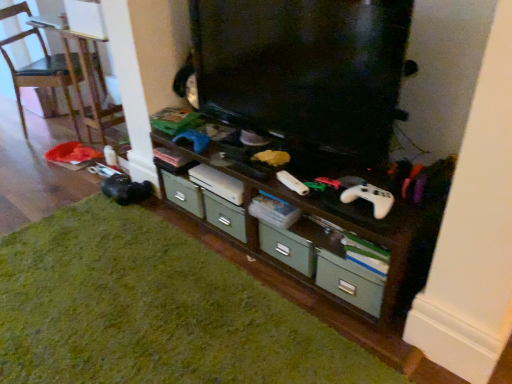
In order to face white matte game controller at center, should I rotate leftwards or rightwards?

To face it directly, rotate right by 15.064 degrees.

What is the approximate width of green matte hardwood at lower left?

green matte hardwood at lower left is 1.80 meters in width.

Describe the element at coordinates (305, 70) in the screenshot. Image resolution: width=512 pixels, height=384 pixels. I see `black glossy television at center` at that location.

What do you see at coordinates (329, 218) in the screenshot?
I see `wooden shelf at center` at bounding box center [329, 218].

The image size is (512, 384). In order to click on white matte game controller at center in this screenshot , I will do `click(370, 198)`.

From a real-world perspective, does wooden shelf at center stand above green matte drawer at lower center?

Yes.

Based on the photo, from the image's perspective, is wooden shelf at center located above or below green matte drawer at lower center?

wooden shelf at center is situated higher than green matte drawer at lower center in the image.

Considering the sizes of objects wooden shelf at center and green matte drawer at lower center in the image provided, who is bigger, wooden shelf at center or green matte drawer at lower center?

With larger size is wooden shelf at center.

From the picture: Considering the relative sizes of wooden shelf at center and white matte game controller at center in the image provided, is wooden shelf at center smaller than white matte game controller at center?

Actually, wooden shelf at center might be larger than white matte game controller at center.

Does point (381, 274) come in front of point (375, 206)?

No, it is behind (375, 206).

From a real-world perspective, is wooden chair at left located higher than green matte drawer at lower center?

Yes, from a real-world perspective, wooden chair at left is on top of green matte drawer at lower center.

Does point (39, 41) appear closer or farther from the camera than point (373, 280)?

Point (39, 41) is positioned farther from the camera compared to point (373, 280).

From the image's perspective, is wooden chair at left above or below green matte drawer at lower center?

From the image's perspective, wooden chair at left appears above green matte drawer at lower center.

Relative to black glossy television at center, is green matte drawer at lower center in front or behind?

In the image, green matte drawer at lower center appears behind black glossy television at center.

Identify the location of drawer below the black glossy television at center (from the image's perspective). (349, 282).

Is green matte drawer at lower center aimed at black glossy television at center?

No, green matte drawer at lower center is not aimed at black glossy television at center.

Which of these two, green matte drawer at lower center or black glossy television at center, is bigger?

Bigger between the two is black glossy television at center.

How different are the orientations of black glossy television at center and green matte hardwood at lower left in degrees?

90 degrees separate the facing orientations of black glossy television at center and green matte hardwood at lower left.

Could you tell me if black glossy television at center is facing green matte hardwood at lower left?

No, black glossy television at center does not turn towards green matte hardwood at lower left.

From a real-world perspective, is black glossy television at center physically above green matte hardwood at lower left?

Correct, in the physical world, black glossy television at center is higher than green matte hardwood at lower left.

Based on the photo, from their relative heights in the image, would you say black glossy television at center is taller or shorter than green matte hardwood at lower left?

Clearly, black glossy television at center is taller compared to green matte hardwood at lower left.

Could you tell me if green matte hardwood at lower left is facing black glossy television at center?

No, green matte hardwood at lower left is not turned towards black glossy television at center.

At what (x,y) coordinates should I click in order to perform the action: click on hardwood below the black glossy television at center (from the image's perspective). Please return your answer as a coordinate pair (x, y). Looking at the image, I should click on (153, 311).

From a real-world perspective, is green matte hardwood at lower left physically above black glossy television at center?

No, from a real-world perspective, green matte hardwood at lower left is not above black glossy television at center.

Can you confirm if green matte hardwood at lower left is positioned to the left of black glossy television at center?

Indeed, green matte hardwood at lower left is positioned on the left side of black glossy television at center.

Does wooden chair at left have a greater height compared to green matte hardwood at lower left?

Yes.

Is wooden chair at left spatially inside green matte hardwood at lower left, or outside of it?

wooden chair at left is not inside green matte hardwood at lower left, it's outside.

From the image's perspective, who appears lower, wooden chair at left or green matte hardwood at lower left?

green matte hardwood at lower left is shown below in the image.

Who is smaller, wooden chair at left or green matte hardwood at lower left?

With smaller size is green matte hardwood at lower left.

You are a GUI agent. You are given a task and a screenshot of the screen. Output one action in this format:
    pyautogui.click(x=<x>, y=<y>)
    Task: Click on the shelf that is above the green matte drawer at lower center (from the image's perspective)
    This screenshot has width=512, height=384.
    Given the screenshot: What is the action you would take?
    pyautogui.click(x=329, y=218)

The height and width of the screenshot is (384, 512). Identify the location of game controller above the wooden shelf at center (from a real-world perspective). (370, 198).

When comparing their distances from green matte drawer at lower center, does wooden shelf at center or black glossy television at center seem closer?

Based on the image, wooden shelf at center appears to be nearer to green matte drawer at lower center.

Estimate the real-world distances between objects in this image. Which object is closer to black glossy television at center, wooden shelf at center or wooden chair at left?

The object closer to black glossy television at center is wooden shelf at center.

From the image, which object appears to be farther from wooden chair at left, green matte hardwood at lower left or green matte drawer at lower center?

green matte drawer at lower center.

From the image, which object appears to be nearer to green matte drawer at lower center, black glossy television at center or white matte game controller at center?

white matte game controller at center lies closer to green matte drawer at lower center than the other object.

When comparing their distances from black glossy television at center, does wooden shelf at center or green matte drawer at lower center seem further?

The object further to black glossy television at center is green matte drawer at lower center.

Which object lies nearer to the anchor point black glossy television at center, green matte hardwood at lower left or white matte game controller at center?

Among the two, white matte game controller at center is located nearer to black glossy television at center.

From the image, which object appears to be farther from wooden chair at left, black glossy television at center or green matte drawer at lower center?

green matte drawer at lower center is further to wooden chair at left.

Looking at the image, which one is located closer to black glossy television at center, white matte game controller at center or wooden chair at left?

Based on the image, white matte game controller at center appears to be nearer to black glossy television at center.

I want to click on shelf situated between wooden chair at left and black glossy television at center from left to right, so click(x=329, y=218).

Where is `shelf located between wooden chair at left and green matte drawer at lower center in the left-right direction`? The height and width of the screenshot is (384, 512). shelf located between wooden chair at left and green matte drawer at lower center in the left-right direction is located at coordinates (329, 218).

Where is `drawer between green matte hardwood at lower left and white matte game controller at center from left to right`? This screenshot has width=512, height=384. drawer between green matte hardwood at lower left and white matte game controller at center from left to right is located at coordinates (349, 282).

Locate an element on the screen. Image resolution: width=512 pixels, height=384 pixels. television positioned between green matte hardwood at lower left and wooden chair at left from near to far is located at coordinates (305, 70).